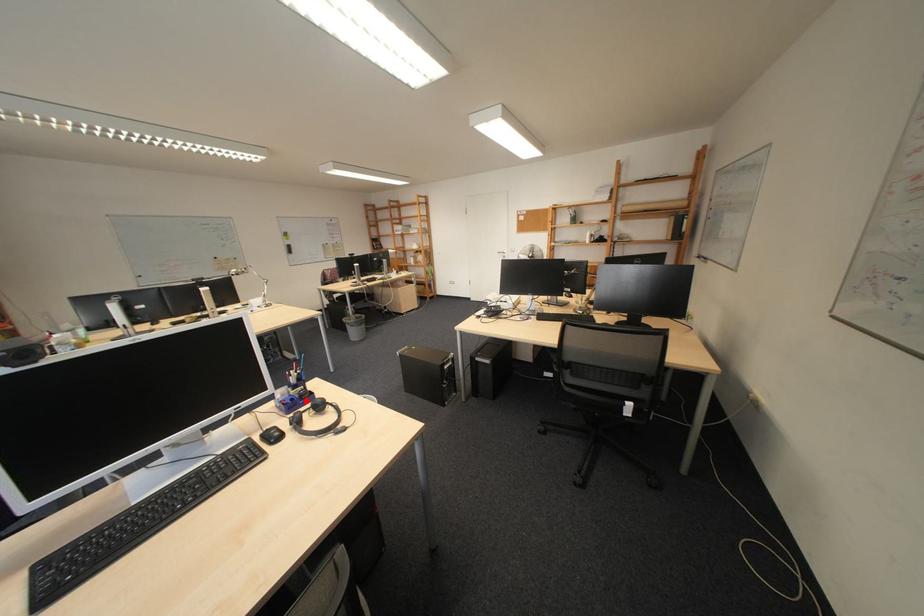
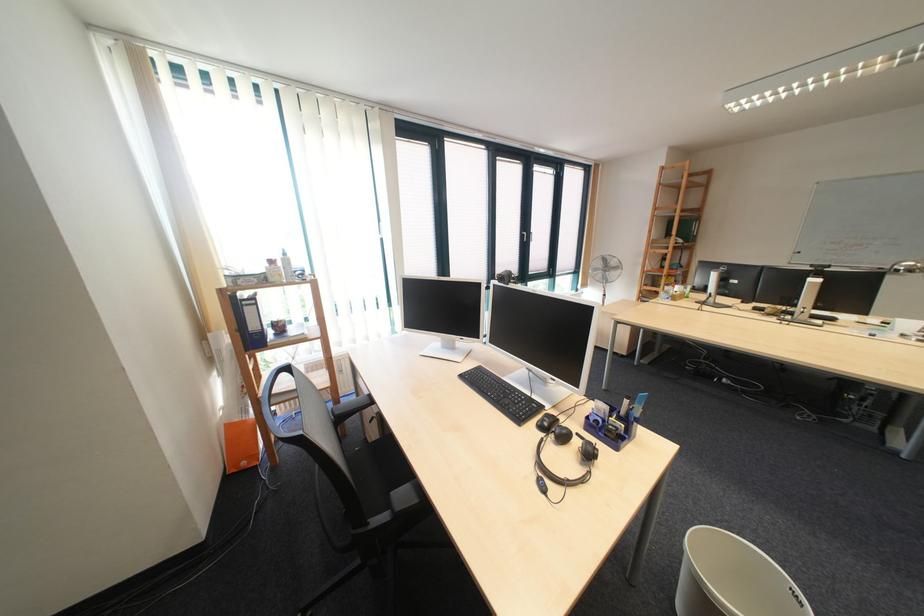
The point at the highlighted location is marked in the first image. Where is the corresponding point in the second image?

(611, 423)